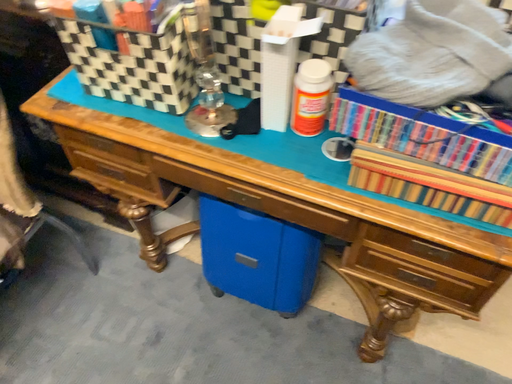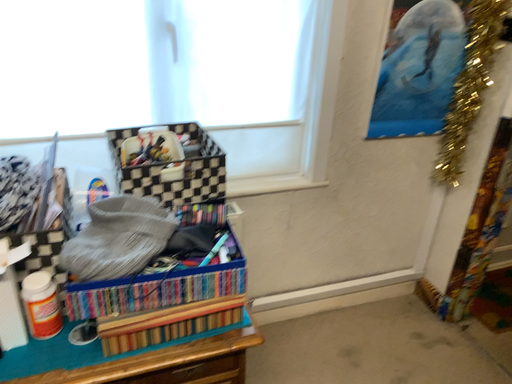
Question: How did the camera likely rotate when shooting the video?

Choices:
 (A) rotated upward
 (B) rotated downward

Answer: (A)